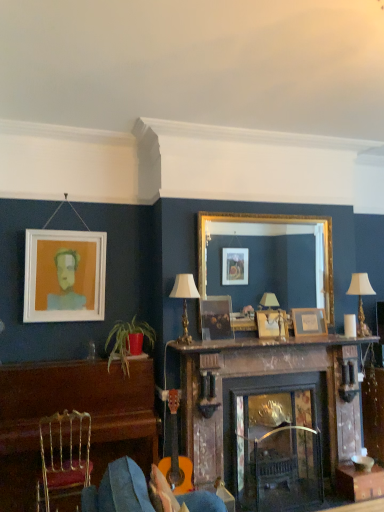
Question: Is wooden frame at upper center, arranged as the first picture frame when viewed from the right, with green leafy plant in red pot at lower left?

Choices:
 (A) yes
 (B) no

Answer: (B)

Question: Does wooden frame at upper center, the 4th picture frame from the left, turn towards green leafy plant in red pot at lower left?

Choices:
 (A) yes
 (B) no

Answer: (B)

Question: Is wooden frame at upper center, arranged as the first picture frame when viewed from the right, not close to green leafy plant in red pot at lower left?

Choices:
 (A) yes
 (B) no

Answer: (A)

Question: Considering the relative sizes of wooden frame at upper center, the 4th picture frame from the left, and green leafy plant in red pot at lower left in the image provided, is wooden frame at upper center, the 4th picture frame from the left, shorter than green leafy plant in red pot at lower left?

Choices:
 (A) yes
 (B) no

Answer: (A)

Question: Is wooden frame at upper center, arranged as the first picture frame when viewed from the right, to the left of green leafy plant in red pot at lower left from the viewer's perspective?

Choices:
 (A) no
 (B) yes

Answer: (A)

Question: Which is correct: white wax candle at center-right is inside gold metallic chair at lower left, or outside of it?

Choices:
 (A) inside
 (B) outside

Answer: (B)

Question: Looking at the image, does white wax candle at center-right seem bigger or smaller compared to gold metallic chair at lower left?

Choices:
 (A) small
 (B) big

Answer: (A)

Question: Considering the positions of point (344, 314) and point (61, 453), is point (344, 314) closer or farther from the camera than point (61, 453)?

Choices:
 (A) farther
 (B) closer

Answer: (A)

Question: From the image's perspective, is white wax candle at center-right positioned above or below gold metallic chair at lower left?

Choices:
 (A) above
 (B) below

Answer: (A)

Question: Which is correct: white fabric lampshade at upper right, the 1th lamp positioned from the back, is inside brown wooden dresser at left, or outside of it?

Choices:
 (A) inside
 (B) outside

Answer: (B)

Question: Considering the positions of white fabric lampshade at upper right, the 2th lamp viewed from the front, and brown wooden dresser at left in the image, is white fabric lampshade at upper right, the 2th lamp viewed from the front, taller or shorter than brown wooden dresser at left?

Choices:
 (A) tall
 (B) short

Answer: (B)

Question: Considering the positions of white fabric lampshade at upper right, the 1th lamp positioned from the back, and brown wooden dresser at left in the image, is white fabric lampshade at upper right, the 1th lamp positioned from the back, wider or thinner than brown wooden dresser at left?

Choices:
 (A) wide
 (B) thin

Answer: (B)

Question: In terms of size, does white fabric lampshade at upper right, the 1th lamp positioned from the back, appear bigger or smaller than brown wooden dresser at left?

Choices:
 (A) small
 (B) big

Answer: (A)

Question: From a real-world perspective, is green leafy plant in red pot at lower left positioned above or below rustic wood fireplace at center?

Choices:
 (A) below
 (B) above

Answer: (B)

Question: Considering the positions of green leafy plant in red pot at lower left and rustic wood fireplace at center in the image, is green leafy plant in red pot at lower left bigger or smaller than rustic wood fireplace at center?

Choices:
 (A) big
 (B) small

Answer: (B)